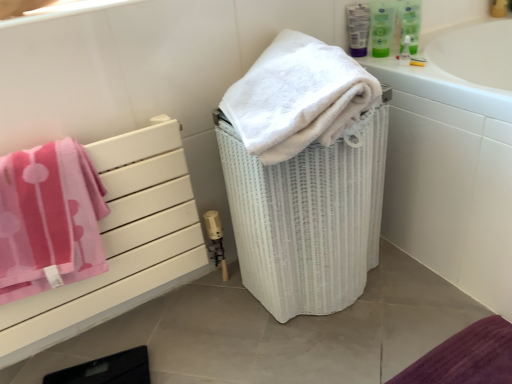
Question: From the image's perspective, does white glossy bathtub at upper right appear higher than white wicker laundry basket at center?

Choices:
 (A) no
 (B) yes

Answer: (B)

Question: From a real-world perspective, is white glossy bathtub at upper right positioned under white wicker laundry basket at center based on gravity?

Choices:
 (A) yes
 (B) no

Answer: (B)

Question: Would you consider white glossy bathtub at upper right to be distant from white wicker laundry basket at center?

Choices:
 (A) yes
 (B) no

Answer: (B)

Question: Would you say white glossy bathtub at upper right is outside white wicker laundry basket at center?

Choices:
 (A) yes
 (B) no

Answer: (A)

Question: Considering the relative sizes of white glossy bathtub at upper right and white wicker laundry basket at center in the image provided, is white glossy bathtub at upper right taller than white wicker laundry basket at center?

Choices:
 (A) yes
 (B) no

Answer: (A)

Question: Considering the positions of green plastic mouthwash at upper right, which appears as the 2th mouthwash when viewed from the right, and translucent plastic mouthwash at upper right, acting as the third mouthwash starting from the right, in the image, is green plastic mouthwash at upper right, which appears as the 2th mouthwash when viewed from the right, wider or thinner than translucent plastic mouthwash at upper right, acting as the third mouthwash starting from the right,?

Choices:
 (A) thin
 (B) wide

Answer: (A)

Question: Based on their sizes in the image, would you say green plastic mouthwash at upper right, arranged as the 2th mouthwash when viewed from the left, is bigger or smaller than translucent plastic mouthwash at upper right, acting as the third mouthwash starting from the right?

Choices:
 (A) small
 (B) big

Answer: (A)

Question: From a real-world perspective, is green plastic mouthwash at upper right, arranged as the 2th mouthwash when viewed from the left, above or below translucent plastic mouthwash at upper right, which is the 1th mouthwash in left-to-right order?

Choices:
 (A) above
 (B) below

Answer: (A)

Question: Relative to translucent plastic mouthwash at upper right, which is the 1th mouthwash in left-to-right order, is green plastic mouthwash at upper right, arranged as the 2th mouthwash when viewed from the left, in front or behind?

Choices:
 (A) front
 (B) behind

Answer: (A)

Question: Which is correct: white fluffy towel at upper right, which ranks as the first towel in right-to-left order, is inside green plastic mouthwash at upper right, which appears as the 2th mouthwash when viewed from the right, or outside of it?

Choices:
 (A) outside
 (B) inside

Answer: (A)

Question: Based on their sizes in the image, would you say white fluffy towel at upper right, which ranks as the first towel in right-to-left order, is bigger or smaller than green plastic mouthwash at upper right, arranged as the 2th mouthwash when viewed from the left?

Choices:
 (A) big
 (B) small

Answer: (A)

Question: From the image's perspective, is white fluffy towel at upper right, positioned as the second towel in left-to-right order, above or below green plastic mouthwash at upper right, arranged as the 2th mouthwash when viewed from the left?

Choices:
 (A) above
 (B) below

Answer: (B)

Question: Does point (264, 56) appear closer or farther from the camera than point (389, 31)?

Choices:
 (A) farther
 (B) closer

Answer: (B)

Question: Is white fluffy towel at upper right, which ranks as the first towel in right-to-left order, in front of or behind green plastic mouthwash at upper right, acting as the 1th mouthwash starting from the right, in the image?

Choices:
 (A) front
 (B) behind

Answer: (A)

Question: Looking at the image, does white fluffy towel at upper right, positioned as the second towel in left-to-right order, seem bigger or smaller compared to green plastic mouthwash at upper right, arranged as the third mouthwash when viewed from the left?

Choices:
 (A) big
 (B) small

Answer: (A)